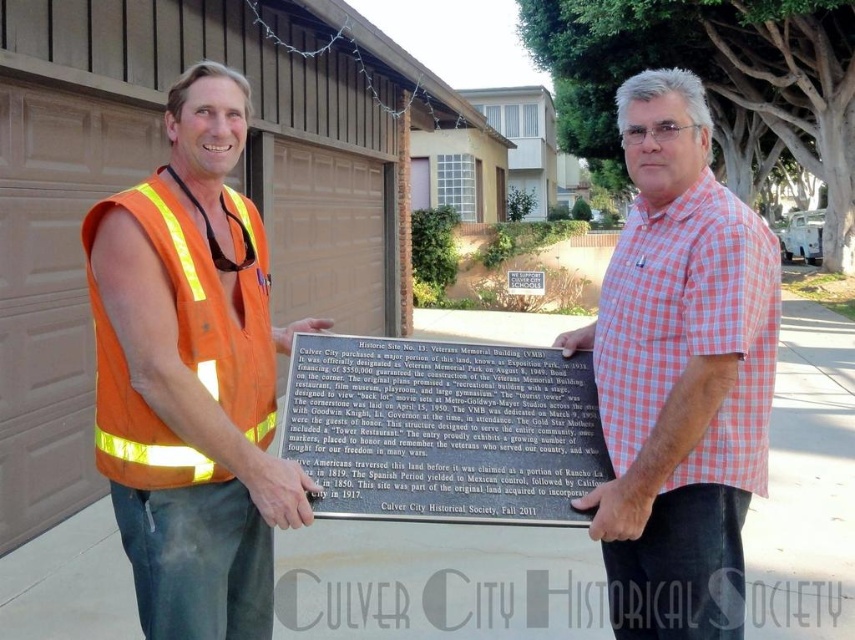
You are a photographer standing 10 feet away from the orange reflective safety vest at left and the pink checkered shirt at center. You want to take a photo that includes both subjects without moving them. Can you position yourself so that both are fully visible in the frame?

The pink checkered shirt at center is 3.56 feet from the orange reflective safety vest at left. Since you are 10 feet away from both subjects, the distance between them is less than the maximum field of view of a standard camera lens, so yes, you can position yourself to capture both in the frame.